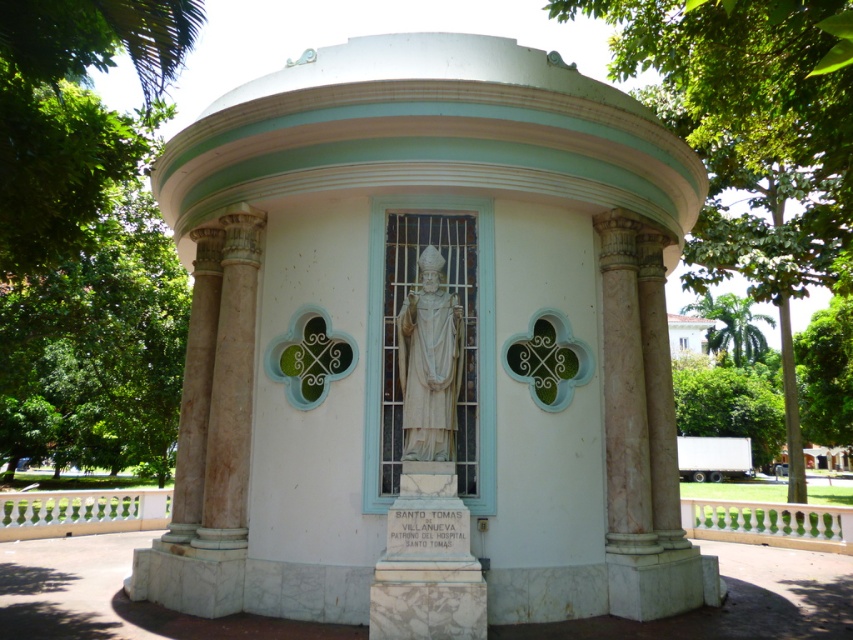
You are standing in a park and want to take a photo of the green leafy tree at center. If your camera is 11.03 feet away from the tree, is that the recommended distance for capturing the entire tree in the frame?

The green leafy tree at center and camera are 11.03 feet apart, so yes, the camera is at the recommended distance to capture the entire tree in the frame.

You are planning to place a new bench in the garden so that it can be seen from both the green leafy tree at center and the white marble statue at center. Based on their widths, which object would allow the bench to be placed closer to it while still being visible from both?

The bench should be placed closer to the white marble statue at center because it is narrower than the green leafy tree at center, allowing for a better viewing angle from both objects.